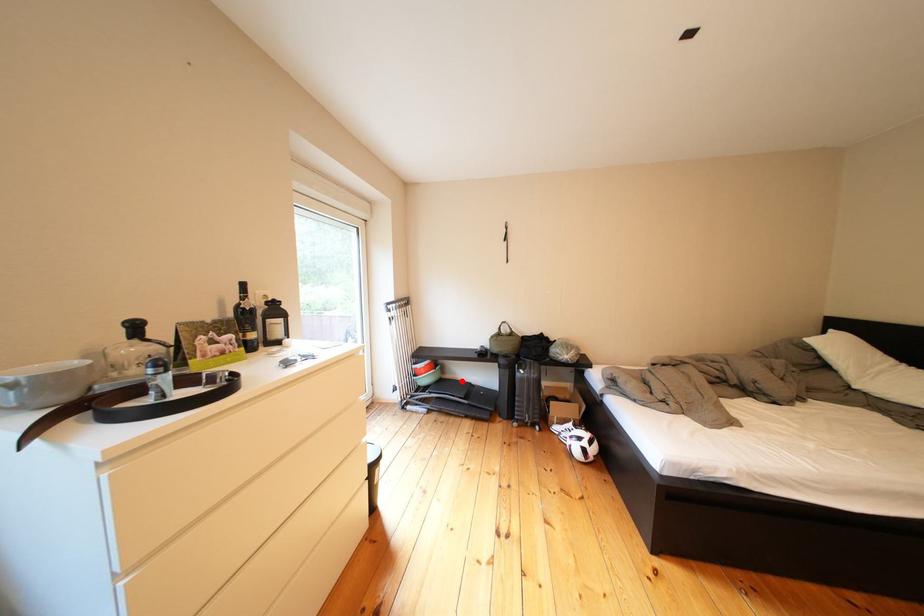
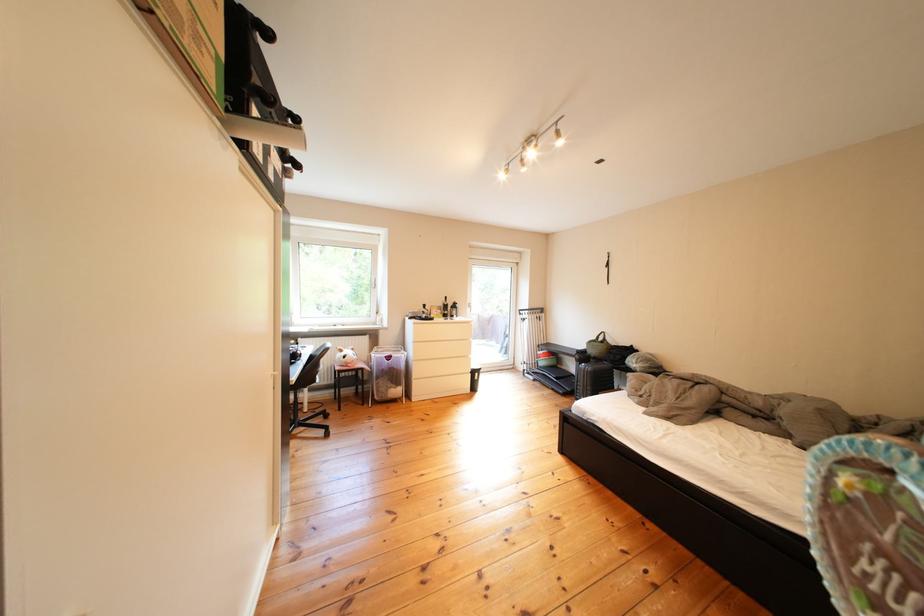
The point at the highlighted location is marked in the first image. Where is the corresponding point in the second image?

(578, 371)